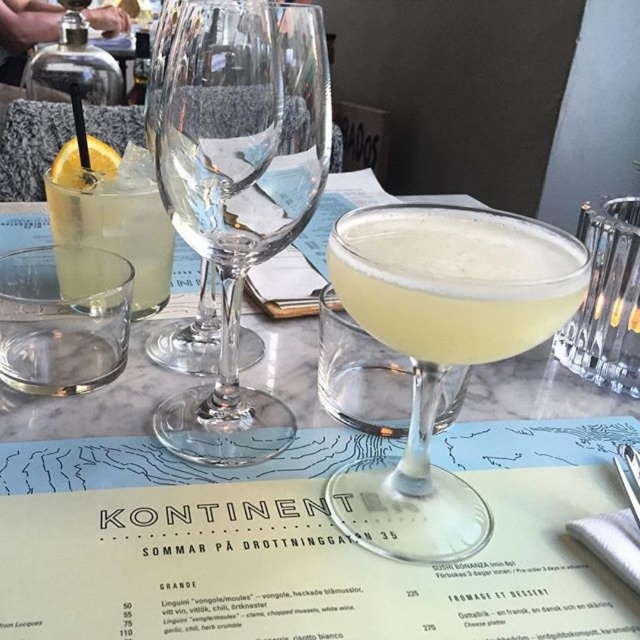
You are a waiter at the restaurant and need to deliver a drink to the customer. The customer has requested the drink closest to them. Which drink should you choose between the matte yellow cocktail at center and the translucent glass at left?

The matte yellow cocktail at center is closer to the viewer than the translucent glass at left, so you should choose the matte yellow cocktail at center as it is closer to the customer.

Based on the photo, you are a server at the restaurant and need to place a napkin between the transparent glass wine glass at center and the translucent glass cocktail at center. How far apart are these two glasses?

The transparent glass wine glass at center is 2.77 inches from the translucent glass cocktail at center, so the napkin needs to be placed within that distance.

You are a server at the restaurant. You need to pour a drink into the larger glass. Which one should you choose between the transparent glass wine glass at center and the translucent glass at left?

The transparent glass wine glass at center is bigger than the translucent glass at left, so you should choose the transparent glass wine glass at center to pour the drink.